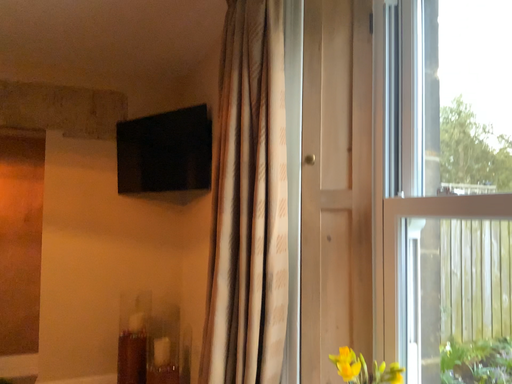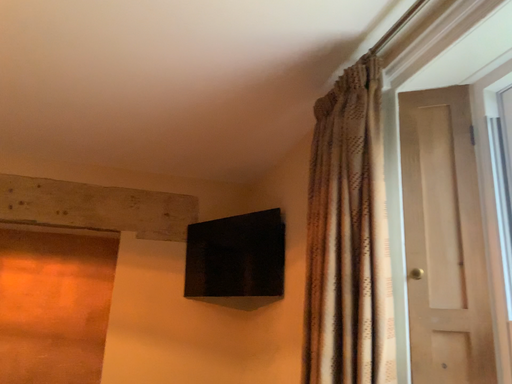
Question: How did the camera likely rotate when shooting the video?

Choices:
 (A) rotated downward
 (B) rotated upward

Answer: (B)